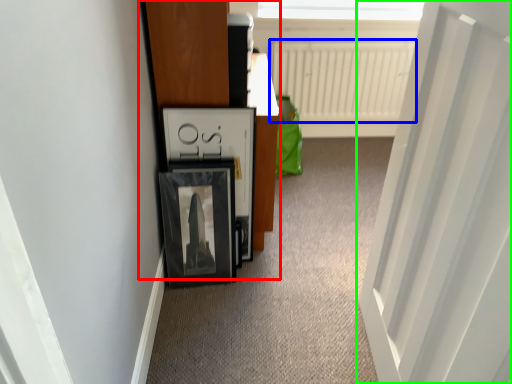
Question: Estimate the real-world distances between objects in this image. Which object is closer to dresser (highlighted by a red box), radiator (highlighted by a blue box) or door (highlighted by a green box)?

Choices:
 (A) radiator
 (B) door

Answer: (B)